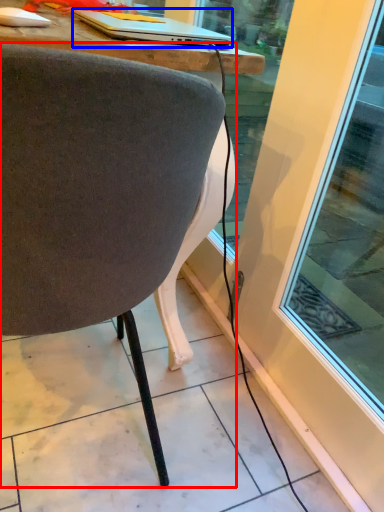
Question: Which object appears farthest to the camera in this image, chair (highlighted by a red box) or laptop (highlighted by a blue box)?

Choices:
 (A) chair
 (B) laptop

Answer: (B)